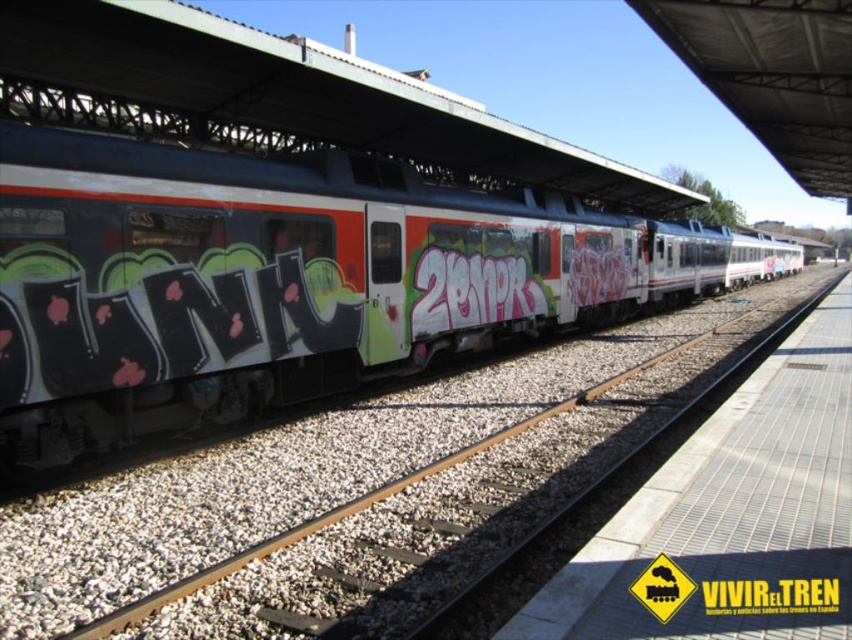
Question: Is smooth concrete train track at center to the right of metal grid platform at center from the viewer's perspective?

Choices:
 (A) yes
 (B) no

Answer: (B)

Question: In this image, where is matte black train at center located relative to smooth concrete train track at center?

Choices:
 (A) left
 (B) right

Answer: (A)

Question: Which is nearer to the smooth concrete train track at center?

Choices:
 (A) matte black train at center
 (B) metal grid platform at center

Answer: (B)

Question: Is matte black train at center smaller than metal grid platform at center?

Choices:
 (A) yes
 (B) no

Answer: (B)

Question: Which object appears closest to the camera in this image?

Choices:
 (A) matte black train at center
 (B) smooth concrete train track at center

Answer: (B)

Question: Which point is closer to the camera taking this photo?

Choices:
 (A) (717, 417)
 (B) (753, 337)
 (C) (79, 198)

Answer: (C)